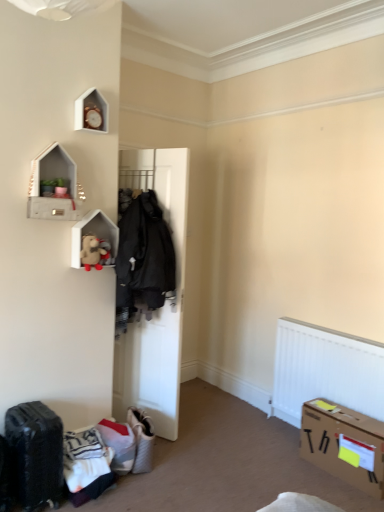
Identify the location of spots to the right of white textured fabric suitcase at lower center, the 2th luggage from the front. This screenshot has width=384, height=512. pyautogui.click(x=177, y=458).